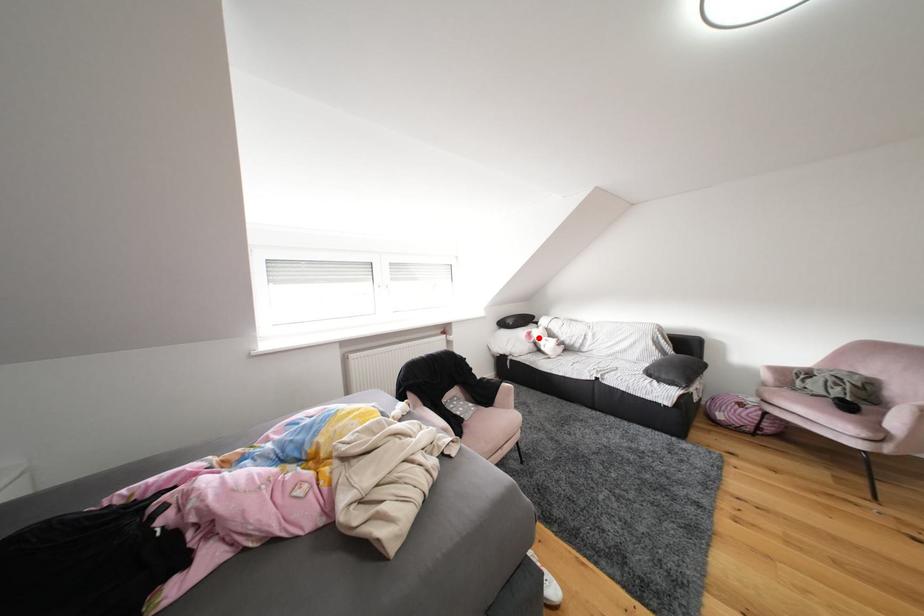
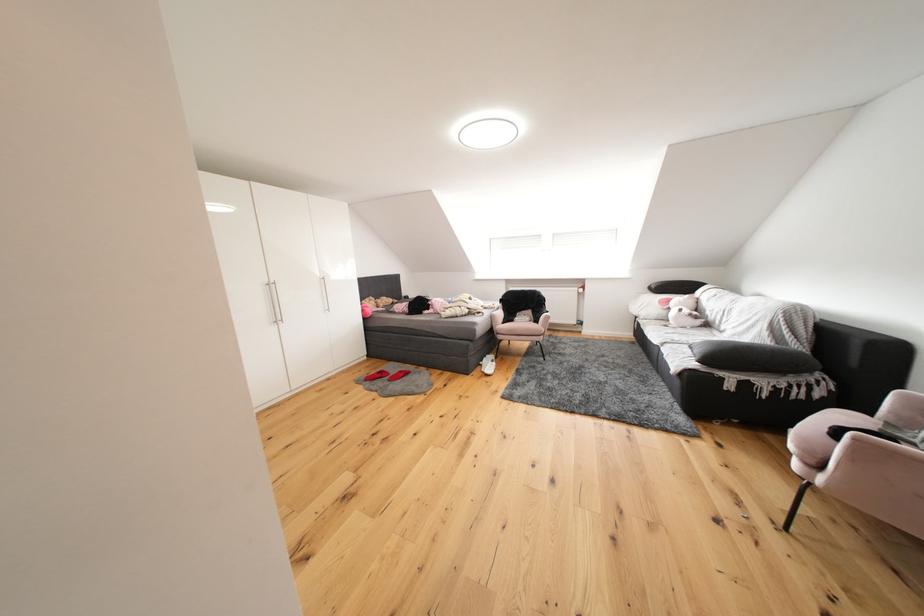
Question: I am providing you with two images of the same scene from different viewpoints. A red point is shown in image1. For the corresponding object point in image2, is it positioned nearer or farther from the camera?

Choices:
 (A) Nearer
 (B) Farther

Answer: (A)